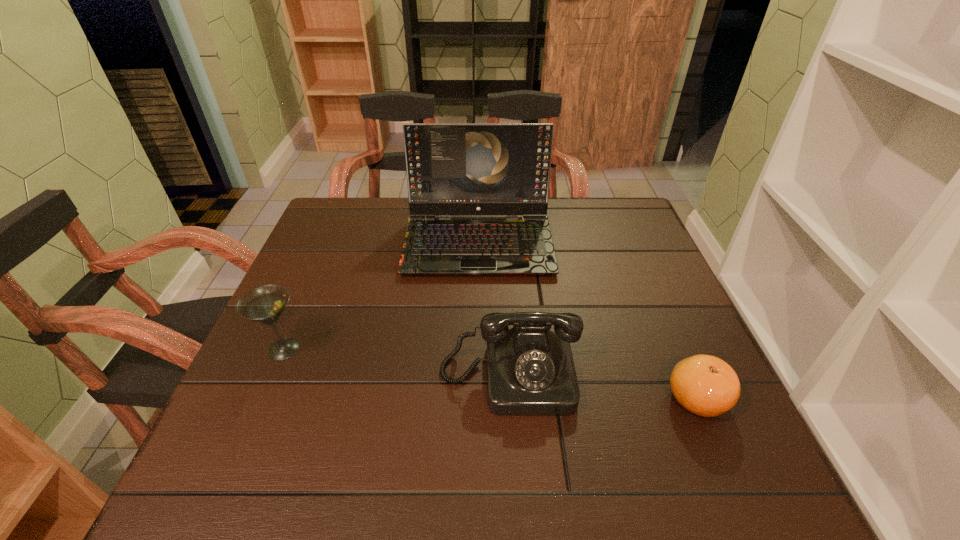
This screenshot has height=540, width=960. In order to click on vacant region located 0.380m on the back of the rightmost object in this screenshot , I will do `click(636, 258)`.

Identify the location of object that is at the far edge. Image resolution: width=960 pixels, height=540 pixels. (452, 168).

At what (x,y) coordinates should I click in order to perform the action: click on object present at the left edge. Please return your answer as a coordinate pair (x, y). Looking at the image, I should click on (265, 304).

Find the location of a particular element. The height and width of the screenshot is (540, 960). object situated at the right edge is located at coordinates (705, 385).

In order to click on free space at the far edge in this screenshot , I will do `click(564, 215)`.

Find the location of `free region at the near edge of the desktop`. free region at the near edge of the desktop is located at coordinates (364, 500).

Locate an element on the screen. This screenshot has width=960, height=540. free space at the left edge of the desktop is located at coordinates (263, 375).

Where is `free region at the right edge`? This screenshot has width=960, height=540. free region at the right edge is located at coordinates (639, 345).

At what (x,y) coordinates should I click in order to perform the action: click on blank space at the far left corner of the desktop. Please return your answer as a coordinate pair (x, y). The image size is (960, 540). Looking at the image, I should click on [350, 213].

Find the location of a particular element. This screenshot has width=960, height=540. free space at the far right corner of the desktop is located at coordinates (590, 211).